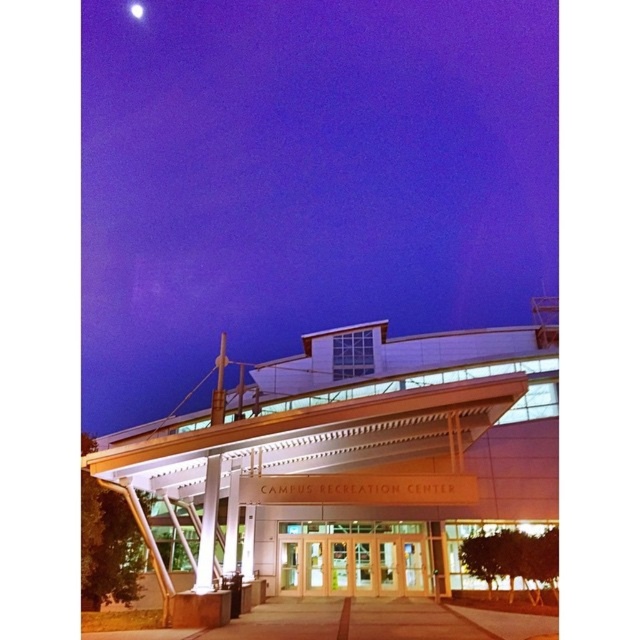
Question: Can you confirm if clear glass doors at center is positioned below white glossy pillar at center?

Choices:
 (A) yes
 (B) no

Answer: (A)

Question: Which point is closer to the camera?

Choices:
 (A) bright white sphere at upper center
 (B) white glossy pillar at center

Answer: (B)

Question: Which point is farther to the camera?

Choices:
 (A) pos(214,461)
 (B) pos(308,529)
 (C) pos(134,10)

Answer: (C)

Question: Is clear glass doors at center to the left of white glossy pillar at center from the viewer's perspective?

Choices:
 (A) yes
 (B) no

Answer: (B)

Question: Among these points, which one is farthest from the camera?

Choices:
 (A) (129, 10)
 (B) (308, 545)
 (C) (211, 516)

Answer: (A)

Question: Is clear glass doors at center above white glossy pillar at center?

Choices:
 (A) no
 (B) yes

Answer: (A)